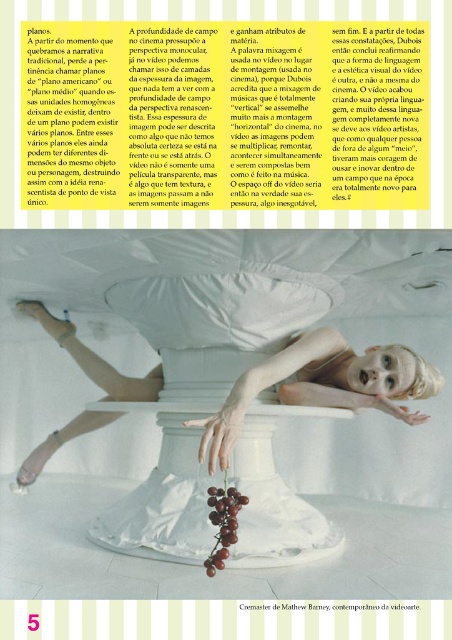
You are an interior designer working on a project and need to place a 6 inch wide decorative item between the white matte dress at center and the white cotton pillow at center. Based on the image, will there be enough space between them to fit the item?

The white matte dress at center is 5.65 inches from the white cotton pillow at center. Since the decorative item is 6 inches wide, there isn

Please provide the exact 2D coordinates of the white matte dress at center in the image. The image has a coordinate system where the top left corner is the origin point. The coordinates are given as a pair of numbers between 0 and 1, representing the horizontal and vertical positions respectively. The horizontal axis goes from left to right, and the vertical axis goes from top to bottom.

The white matte dress at center is located at the coordinates point (324, 385).

You are analyzing the composition of the image. There are two points marked in the image, point (235, 406) and point (161, 301). Which of these two points is closer to the viewer?

Point (235, 406) is closer to the camera than point (161, 301).